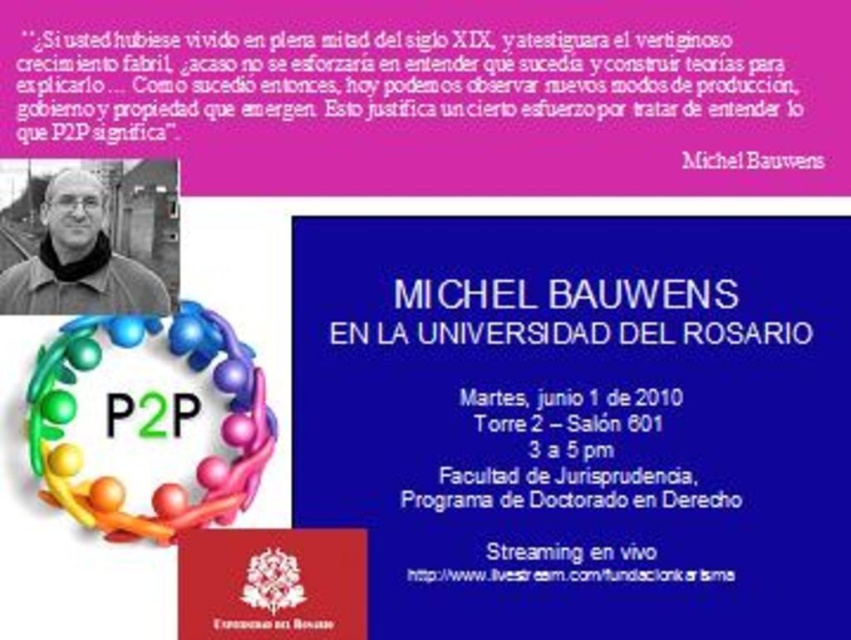
You are standing 1 meter away from the poster. Can you comfortably read the white text on blue background at center without moving closer?

The white text on blue background at center is 1.26 meters away from the camera. Since you are standing 1 meter away, you are closer to the text than the camera was, so you can comfortably read it without moving closer.

You are looking at the promotional poster for Michel Bauwens. There are two points marked on the poster at coordinates point (4, 100) and point (70, 202). Which point is closer to you?

Point (4, 100) is in front of point (70, 202), so it is closer to you.

Where is the pink paper at upper center located in the image?

The pink paper at upper center is located at point (375, 83).